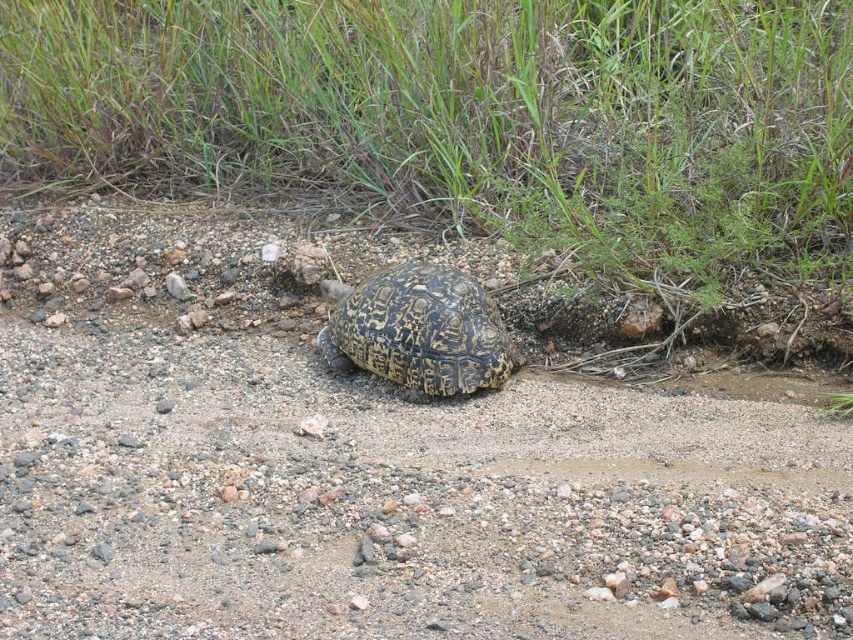
Question: Among these objects, which one is farthest from the camera?

Choices:
 (A) green grass at upper center
 (B) leopard print shell at center
 (C) brown gravel dirt track at center

Answer: (A)

Question: Considering the relative positions of brown gravel dirt track at center and leopard print shell at center in the image provided, where is brown gravel dirt track at center located with respect to leopard print shell at center?

Choices:
 (A) right
 (B) left

Answer: (B)

Question: Can you confirm if green grass at upper center is positioned to the left of leopard print shell at center?

Choices:
 (A) yes
 (B) no

Answer: (A)

Question: Which point is closer to the camera?

Choices:
 (A) leopard print shell at center
 (B) brown gravel dirt track at center
 (C) green grass at upper center

Answer: (B)

Question: Can you confirm if green grass at upper center is wider than leopard print shell at center?

Choices:
 (A) yes
 (B) no

Answer: (A)

Question: Which of the following is the farthest from the observer?

Choices:
 (A) brown gravel dirt track at center
 (B) leopard print shell at center

Answer: (B)